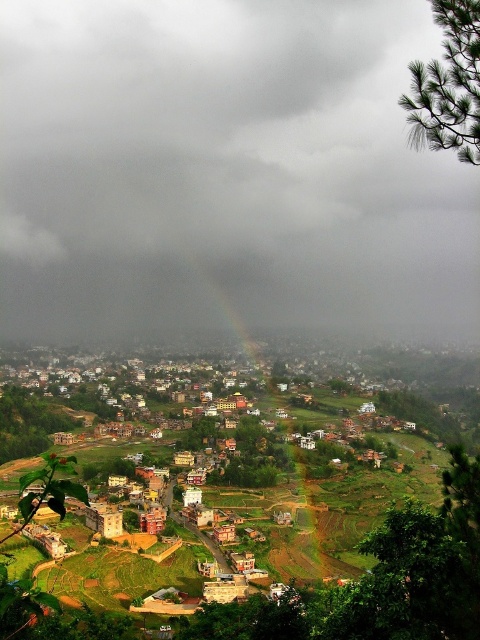
You are a drone operator who needs to capture a photo of the multicolored clay houses at center from the cloudy gray sky at upper center. What is the minimum height the drone must reach to ensure it can hover above the houses and take the photo?

The cloudy gray sky at upper center is 320.02 meters from the multicolored clay houses at center, so the drone must reach at least 320.02 meters in height to hover above the houses and take the photo.

You are standing in the valley looking at the city. There is a point labeled as point (226, 173). What is located at that point?

The cloudy gray sky at upper center is located at point (226, 173).